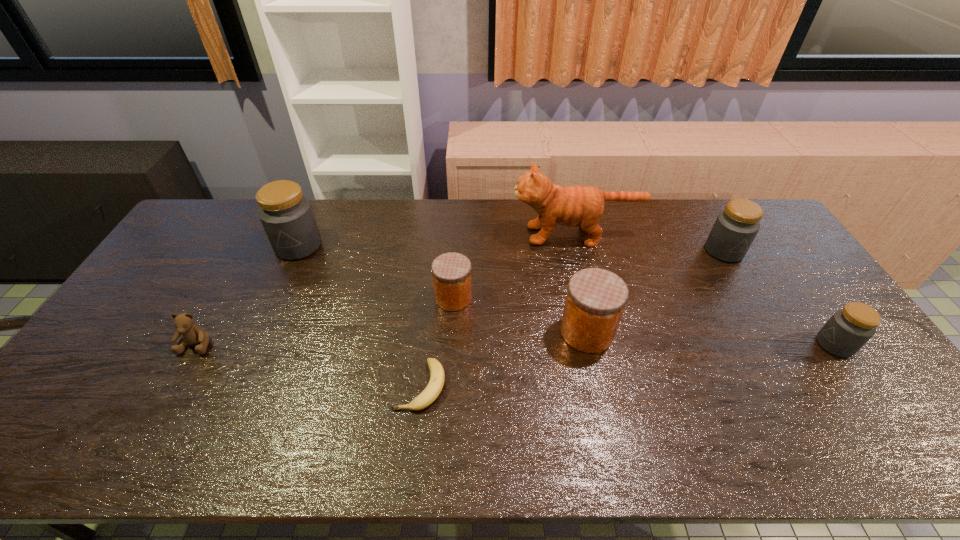
Where is `cat`? cat is located at coordinates (572, 206).

Locate an element on the screen. The height and width of the screenshot is (540, 960). the tallest object is located at coordinates (572, 206).

At what (x,y) coordinates should I click in order to perform the action: click on the leftmost jar. Please return your answer as a coordinate pair (x, y). This screenshot has width=960, height=540. Looking at the image, I should click on (287, 217).

I want to click on the leftmost gray jar, so click(x=287, y=217).

You are a GUI agent. You are given a task and a screenshot of the screen. Output one action in this format:
    pyautogui.click(x=<x>, y=<y>)
    Task: Click on the second smallest gray jar
    
    Given the screenshot: What is the action you would take?
    pyautogui.click(x=735, y=228)

At what (x,y) coordinates should I click in order to perform the action: click on the second gray jar from right to left. Please return your answer as a coordinate pair (x, y). Looking at the image, I should click on (735, 228).

At what (x,y) coordinates should I click in order to perform the action: click on the right orange jar. Please return your answer as a coordinate pair (x, y). Looking at the image, I should click on (595, 301).

You are a GUI agent. You are given a task and a screenshot of the screen. Output one action in this format:
    pyautogui.click(x=<x>, y=<y>)
    Task: Click on the third jar from left to right
    The height and width of the screenshot is (540, 960).
    Given the screenshot: What is the action you would take?
    pyautogui.click(x=595, y=301)

This screenshot has height=540, width=960. I want to click on the second jar from left to right, so click(451, 272).

In order to click on the left orange jar in this screenshot , I will do tap(451, 272).